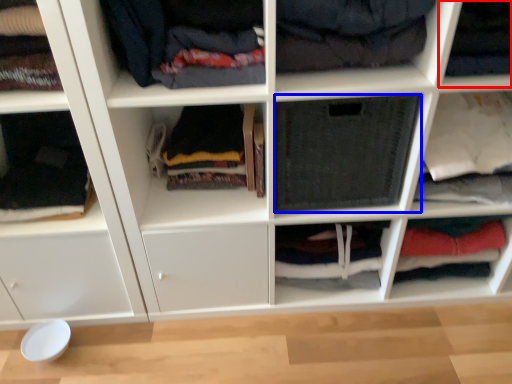
Question: Which point is closer to the camera, shelf (highlighted by a red box) or clothing (highlighted by a blue box)?

Choices:
 (A) shelf
 (B) clothing

Answer: (A)